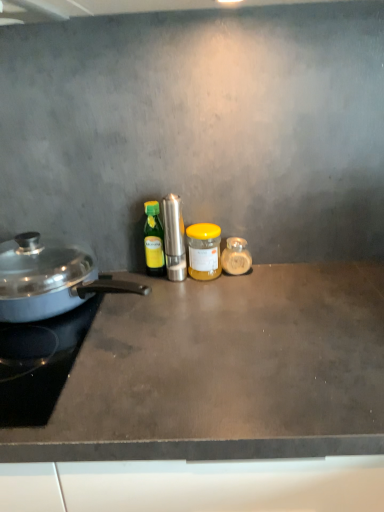
What do you see at coordinates (50, 278) in the screenshot? I see `shiny silver pan at left, acting as the fifth kitchen appliance starting from the right` at bounding box center [50, 278].

This screenshot has width=384, height=512. I want to click on black glass gas stove at left, so click(39, 364).

What is the approximate width of dark gray concrete countertop at center?

→ The width of dark gray concrete countertop at center is 58.41 centimeters.

What is the approximate width of yellow matte jar at center, arranged as the 2th kitchen appliance when viewed from the right?

yellow matte jar at center, arranged as the 2th kitchen appliance when viewed from the right, is 4.18 inches wide.

In order to face translucent glass jar at center, acting as the 5th kitchen appliance starting from the left, should I rotate leftwards or rightwards?

To align with it, rotate right about 5.995°.

Describe the element at coordinates (236, 256) in the screenshot. I see `translucent glass jar at center, the first kitchen appliance when ordered from right to left` at that location.

I want to click on shiny silver pan at left, acting as the fifth kitchen appliance starting from the right, so coord(50,278).

Looking at this image, is polished stainless steel grinder at center, which ranks as the 3th kitchen appliance in right-to-left order, not inside translucent glass jar at center, acting as the 5th kitchen appliance starting from the left?

Yes.

What are the coordinates of `the 2nd kitchen appliance to the left of the translucent glass jar at center, the first kitchen appliance when ordered from right to left, starting your count from the anchor` in the screenshot? It's located at (174, 238).

Does polished stainless steel grinder at center, which ranks as the 3th kitchen appliance in right-to-left order, turn towards translucent glass jar at center, the first kitchen appliance when ordered from right to left?

No.

Consider the image. Between polished stainless steel grinder at center, the third kitchen appliance when ordered from left to right, and translucent glass jar at center, the first kitchen appliance when ordered from right to left, which one appears on the left side from the viewer's perspective?

polished stainless steel grinder at center, the third kitchen appliance when ordered from left to right.

Is dark gray concrete countertop at center looking in the opposite direction of black glass gas stove at left?

No, black glass gas stove at left is not at the back of dark gray concrete countertop at center.

Looking at this image, from a real-world perspective, who is located lower, dark gray concrete countertop at center or black glass gas stove at left?

dark gray concrete countertop at center, from a real-world perspective.

Based on their sizes in the image, would you say green glass bottle at center, positioned as the 4th kitchen appliance in right-to-left order, is bigger or smaller than shiny silver pan at left, acting as the fifth kitchen appliance starting from the right?

In the image, green glass bottle at center, positioned as the 4th kitchen appliance in right-to-left order, appears to be smaller than shiny silver pan at left, acting as the fifth kitchen appliance starting from the right.

Is green glass bottle at center, marked as the second kitchen appliance in a left-to-right arrangement, turned away from shiny silver pan at left, acting as the fifth kitchen appliance starting from the right?

Correct, green glass bottle at center, marked as the second kitchen appliance in a left-to-right arrangement, is looking away from shiny silver pan at left, acting as the fifth kitchen appliance starting from the right.

Considering the relative sizes of green glass bottle at center, marked as the second kitchen appliance in a left-to-right arrangement, and shiny silver pan at left, acting as the fifth kitchen appliance starting from the right, in the image provided, is green glass bottle at center, marked as the second kitchen appliance in a left-to-right arrangement, wider than shiny silver pan at left, acting as the fifth kitchen appliance starting from the right,?

Incorrect, the width of green glass bottle at center, marked as the second kitchen appliance in a left-to-right arrangement, does not surpass that of shiny silver pan at left, acting as the fifth kitchen appliance starting from the right.

From the image's perspective, is green glass bottle at center, marked as the second kitchen appliance in a left-to-right arrangement, located above or below shiny silver pan at left, acting as the fifth kitchen appliance starting from the right?

Based on their image positions, green glass bottle at center, marked as the second kitchen appliance in a left-to-right arrangement, is located above shiny silver pan at left, acting as the fifth kitchen appliance starting from the right.

Between point (93, 271) and point (232, 273), which one is positioned in front?

The point (232, 273) is closer to the camera.

Which of these two, shiny silver pan at left, acting as the fifth kitchen appliance starting from the right, or translucent glass jar at center, acting as the 5th kitchen appliance starting from the left, is wider?

Wider between the two is shiny silver pan at left, acting as the fifth kitchen appliance starting from the right.

Is shiny silver pan at left, acting as the fifth kitchen appliance starting from the right, aimed at translucent glass jar at center, acting as the 5th kitchen appliance starting from the left?

No.

Is the position of shiny silver pan at left, acting as the fifth kitchen appliance starting from the right, less distant than that of translucent glass jar at center, the first kitchen appliance when ordered from right to left?

Yes, shiny silver pan at left, acting as the fifth kitchen appliance starting from the right, is closer to the viewer.

Does green glass bottle at center, marked as the second kitchen appliance in a left-to-right arrangement, have a lesser height compared to dark gray concrete countertop at center?

Yes, green glass bottle at center, marked as the second kitchen appliance in a left-to-right arrangement, is shorter than dark gray concrete countertop at center.

Does point (150, 258) come closer to viewer compared to point (249, 429)?

No, it is behind (249, 429).

Can dark gray concrete countertop at center be found inside green glass bottle at center, marked as the second kitchen appliance in a left-to-right arrangement?

No, dark gray concrete countertop at center is not a part of green glass bottle at center, marked as the second kitchen appliance in a left-to-right arrangement.

How many degrees apart are the facing directions of green glass bottle at center, positioned as the 4th kitchen appliance in right-to-left order, and dark gray concrete countertop at center?

The facing directions of green glass bottle at center, positioned as the 4th kitchen appliance in right-to-left order, and dark gray concrete countertop at center are 1.09 degrees apart.

Is shiny silver pan at left, placed as the 1th kitchen appliance when sorted from left to right, at the back of polished stainless steel grinder at center, which ranks as the 3th kitchen appliance in right-to-left order?

No.

From the image's perspective, would you say polished stainless steel grinder at center, the third kitchen appliance when ordered from left to right, is shown under shiny silver pan at left, placed as the 1th kitchen appliance when sorted from left to right?

No, from the image's perspective, polished stainless steel grinder at center, the third kitchen appliance when ordered from left to right, is not below shiny silver pan at left, placed as the 1th kitchen appliance when sorted from left to right.

Can you confirm if polished stainless steel grinder at center, which ranks as the 3th kitchen appliance in right-to-left order, is smaller than shiny silver pan at left, placed as the 1th kitchen appliance when sorted from left to right?

Yes, polished stainless steel grinder at center, which ranks as the 3th kitchen appliance in right-to-left order, is smaller than shiny silver pan at left, placed as the 1th kitchen appliance when sorted from left to right.

Considering the sizes of objects polished stainless steel grinder at center, the third kitchen appliance when ordered from left to right, and shiny silver pan at left, acting as the fifth kitchen appliance starting from the right, in the image provided, who is shorter, polished stainless steel grinder at center, the third kitchen appliance when ordered from left to right, or shiny silver pan at left, acting as the fifth kitchen appliance starting from the right,?

With less height is shiny silver pan at left, acting as the fifth kitchen appliance starting from the right.

From the picture: Who is shorter, black glass gas stove at left or green glass bottle at center, positioned as the 4th kitchen appliance in right-to-left order?

black glass gas stove at left is shorter.

Is black glass gas stove at left wider or thinner than green glass bottle at center, positioned as the 4th kitchen appliance in right-to-left order?

black glass gas stove at left is wider than green glass bottle at center, positioned as the 4th kitchen appliance in right-to-left order.

Which of these two, black glass gas stove at left or green glass bottle at center, positioned as the 4th kitchen appliance in right-to-left order, is smaller?

green glass bottle at center, positioned as the 4th kitchen appliance in right-to-left order.

Considering the points (32, 389) and (156, 267), which point is behind, point (32, 389) or point (156, 267)?

The point (156, 267) is more distant.

At what (x,y) coordinates should I click in order to perform the action: click on the 3rd kitchen appliance behind the polished stainless steel grinder at center, the third kitchen appliance when ordered from left to right. Please return your answer as a coordinate pair (x, y). This screenshot has height=512, width=384. Looking at the image, I should click on (236, 256).

This screenshot has height=512, width=384. In order to click on countertop located on the right of black glass gas stove at left in this screenshot , I will do `click(225, 371)`.

Considering their positions, is polished stainless steel grinder at center, which ranks as the 3th kitchen appliance in right-to-left order, positioned closer to green glass bottle at center, positioned as the 4th kitchen appliance in right-to-left order, than yellow matte jar at center, arranged as the 2th kitchen appliance when viewed from the right?

Among the two, polished stainless steel grinder at center, which ranks as the 3th kitchen appliance in right-to-left order, is located nearer to green glass bottle at center, positioned as the 4th kitchen appliance in right-to-left order.

From the image, which object appears to be nearer to translucent glass jar at center, the first kitchen appliance when ordered from right to left, shiny silver pan at left, placed as the 1th kitchen appliance when sorted from left to right, or polished stainless steel grinder at center, which ranks as the 3th kitchen appliance in right-to-left order?

polished stainless steel grinder at center, which ranks as the 3th kitchen appliance in right-to-left order.

Based on the photo, considering their positions, is dark gray concrete countertop at center positioned further to black glass gas stove at left than yellow matte jar at center, arranged as the 2th kitchen appliance when viewed from the right?

yellow matte jar at center, arranged as the 2th kitchen appliance when viewed from the right, is positioned further to the anchor black glass gas stove at left.

Based on their spatial positions, is green glass bottle at center, marked as the second kitchen appliance in a left-to-right arrangement, or translucent glass jar at center, the first kitchen appliance when ordered from right to left, further from polished stainless steel grinder at center, the third kitchen appliance when ordered from left to right?

Based on the image, translucent glass jar at center, the first kitchen appliance when ordered from right to left, appears to be further to polished stainless steel grinder at center, the third kitchen appliance when ordered from left to right.

Based on their spatial positions, is yellow matte jar at center, arranged as the 2th kitchen appliance when viewed from the right, or translucent glass jar at center, acting as the 5th kitchen appliance starting from the left, closer to dark gray concrete countertop at center?

Based on the image, yellow matte jar at center, arranged as the 2th kitchen appliance when viewed from the right, appears to be nearer to dark gray concrete countertop at center.

From the image, which object appears to be farther from shiny silver pan at left, placed as the 1th kitchen appliance when sorted from left to right, dark gray concrete countertop at center or yellow matte jar at center, the fourth kitchen appliance viewed from the left?

Based on the image, yellow matte jar at center, the fourth kitchen appliance viewed from the left, appears to be further to shiny silver pan at left, placed as the 1th kitchen appliance when sorted from left to right.

From the image, which object appears to be farther from shiny silver pan at left, placed as the 1th kitchen appliance when sorted from left to right, polished stainless steel grinder at center, the third kitchen appliance when ordered from left to right, or black glass gas stove at left?

polished stainless steel grinder at center, the third kitchen appliance when ordered from left to right, lies further to shiny silver pan at left, placed as the 1th kitchen appliance when sorted from left to right, than the other object.

Estimate the real-world distances between objects in this image. Which object is further from dark gray concrete countertop at center, polished stainless steel grinder at center, the third kitchen appliance when ordered from left to right, or shiny silver pan at left, acting as the fifth kitchen appliance starting from the right?

polished stainless steel grinder at center, the third kitchen appliance when ordered from left to right, is further to dark gray concrete countertop at center.

You are a GUI agent. You are given a task and a screenshot of the screen. Output one action in this format:
    pyautogui.click(x=<x>, y=<y>)
    Task: Click on the gas stove between polished stainless steel grinder at center, the third kitchen appliance when ordered from left to right, and dark gray concrete countertop at center from top to bottom
    The image size is (384, 512).
    Given the screenshot: What is the action you would take?
    pyautogui.click(x=39, y=364)

You are a GUI agent. You are given a task and a screenshot of the screen. Output one action in this format:
    pyautogui.click(x=<x>, y=<y>)
    Task: Click on the gas stove that lies between yellow matte jar at center, arranged as the 2th kitchen appliance when viewed from the right, and dark gray concrete countertop at center from top to bottom
    This screenshot has width=384, height=512.
    Given the screenshot: What is the action you would take?
    pyautogui.click(x=39, y=364)

The image size is (384, 512). In order to click on gas stove between shiny silver pan at left, acting as the fifth kitchen appliance starting from the right, and dark gray concrete countertop at center, in the vertical direction in this screenshot , I will do `click(39, 364)`.

The width and height of the screenshot is (384, 512). Identify the location of kitchen appliance located between green glass bottle at center, marked as the second kitchen appliance in a left-to-right arrangement, and yellow matte jar at center, the fourth kitchen appliance viewed from the left, in the left-right direction. (174, 238).